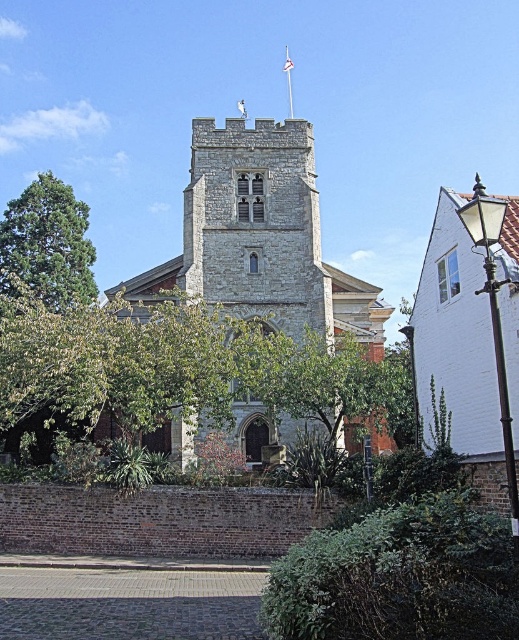
Question: Estimate the real-world distances between objects in this image. Which object is farther from the stone church at center?

Choices:
 (A) green leafy tree at center
 (B) green leafy tree at left

Answer: (B)

Question: Does green leafy tree at center lie behind green leafy tree at left?

Choices:
 (A) yes
 (B) no

Answer: (B)

Question: Does stone church at center appear on the left side of green leafy tree at center?

Choices:
 (A) no
 (B) yes

Answer: (B)

Question: Which object appears farthest from the camera in this image?

Choices:
 (A) green leafy tree at left
 (B) stone church at center

Answer: (A)

Question: Which of the following is the closest to the observer?

Choices:
 (A) (249, 355)
 (B) (84, 236)

Answer: (A)

Question: Is stone church at center further to the viewer compared to green leafy tree at left?

Choices:
 (A) no
 (B) yes

Answer: (A)